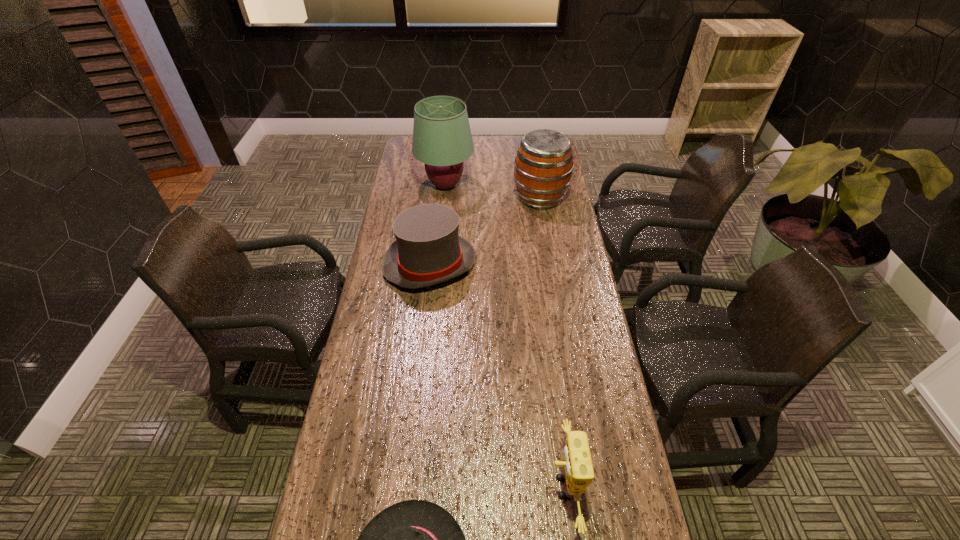
Locate an element on the screen. The image size is (960, 540). blank space at the left edge is located at coordinates (407, 179).

Where is `vacant space at the right edge of the desktop`? vacant space at the right edge of the desktop is located at coordinates (537, 217).

Locate an element on the screen. vacant area that lies between the tallest object and the cider is located at coordinates (492, 191).

In order to click on vacant region between the cider and the tallest object in this screenshot , I will do `click(492, 191)`.

What are the coordinates of `the fourth closest object to the nearer dress hat` in the screenshot? It's located at (442, 139).

Locate an element on the screen. the fourth closest object relative to the nearer dress hat is located at coordinates (442, 139).

What are the coordinates of `free point that satisfies the following two spatial constraints: 1. on the back side of the taller dress hat; 2. on the left side of the lampshade` in the screenshot? It's located at (439, 185).